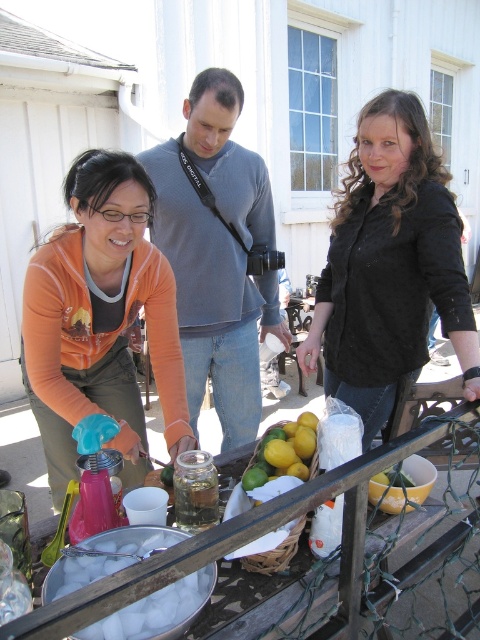
Between clear plastic ice at lower left and yellow matte lemons at center, which one is positioned higher?

Positioned higher is yellow matte lemons at center.

Does point (180, 592) come in front of point (261, 468)?

That is True.

Where is `clear plastic ice at lower left`? clear plastic ice at lower left is located at coordinates (159, 611).

Who is more distant from viewer, (36,355) or (96,566)?

The point (36,355) is behind.

Does point (36, 310) come farther from viewer compared to point (123, 536)?

Yes, point (36, 310) is farther from viewer.

Describe the element at coordinates (100, 321) in the screenshot. The width and height of the screenshot is (480, 640). I see `orange fabric apron at lower left` at that location.

In order to click on orange fabric apron at lower left in this screenshot , I will do `click(100, 321)`.

Is point (116, 244) positioned in front of point (230, 204)?

Yes, point (116, 244) is in front of point (230, 204).

Is orange fabric apron at lower left above gray cotton sweater at center?

No.

The image size is (480, 640). I want to click on orange fabric apron at lower left, so click(x=100, y=321).

At what (x,y) coordinates should I click in order to perform the action: click on orange fabric apron at lower left. Please return your answer as a coordinate pair (x, y). This screenshot has height=640, width=480. Looking at the image, I should click on (100, 321).